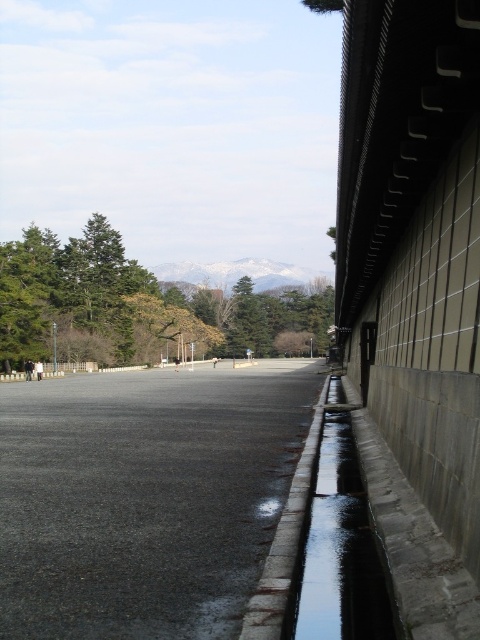
Who is higher up, black asphalt pavement at center or gray concrete curb at lower right?

gray concrete curb at lower right

Who is shorter, black asphalt pavement at center or gray concrete curb at lower right?

With less height is gray concrete curb at lower right.

Is point (24, 506) positioned before point (287, 552)?

No, it is not.

Find the location of a particular element. black asphalt pavement at center is located at coordinates [144, 497].

What do you see at coordinates (137, 307) in the screenshot? I see `green leafy tree at upper left` at bounding box center [137, 307].

Does green leafy tree at upper left have a greater width compared to clear glass puddle at right?

Indeed, green leafy tree at upper left has a greater width compared to clear glass puddle at right.

The width and height of the screenshot is (480, 640). I want to click on green leafy tree at upper left, so 137,307.

Is clear glass puddle at right thinner than gray concrete curb at lower right?

Yes, clear glass puddle at right is thinner than gray concrete curb at lower right.

Between point (354, 481) and point (295, 492), which one is positioned behind?

Point (354, 481)

This screenshot has width=480, height=640. I want to click on clear glass puddle at right, so click(x=339, y=548).